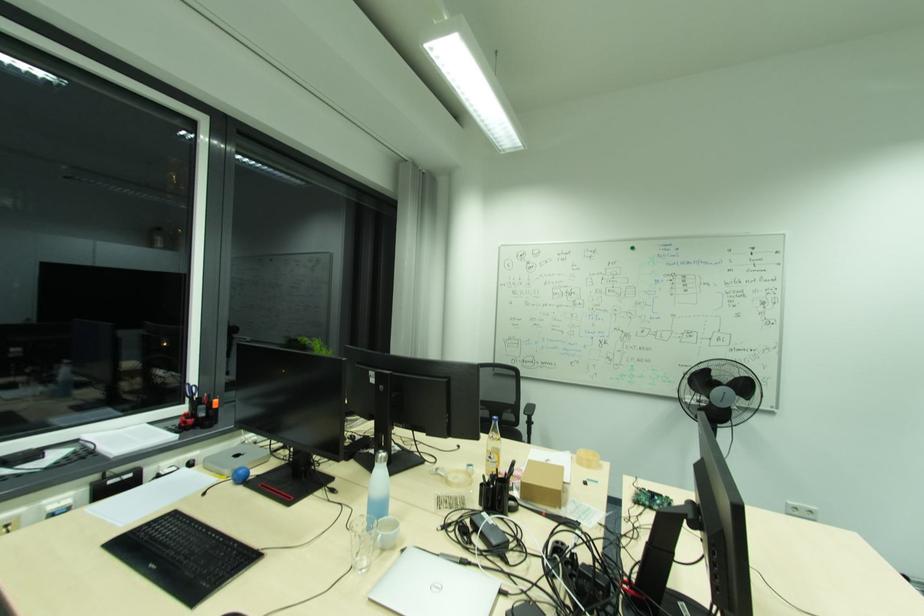
Locate an element on the screen. Image resolution: width=924 pixels, height=616 pixels. black desk fan is located at coordinates (720, 392).